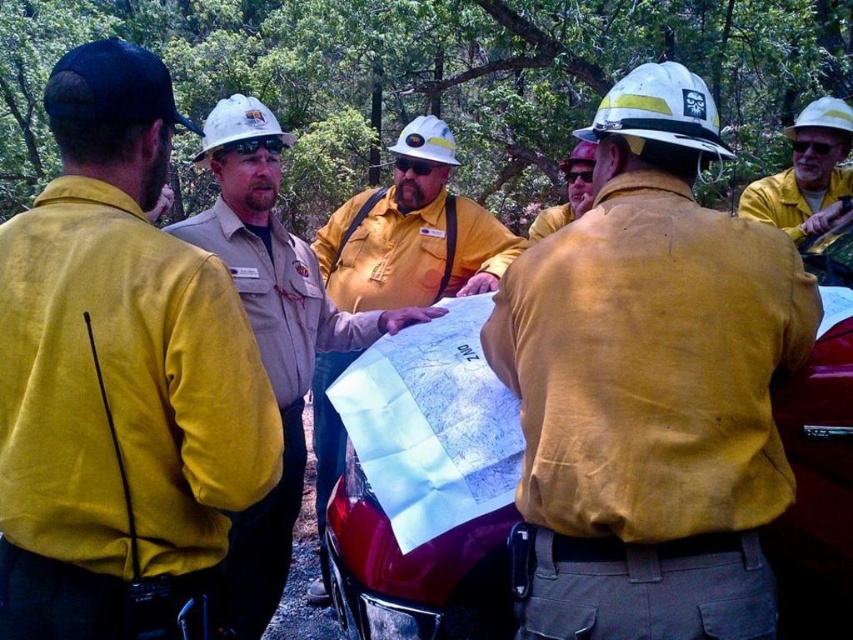
You are a new member of the team and need to locate the white hard hat at center and the matte yellow safety vest at center. Based on the scene description, which object is positioned to the right of the other?

The matte yellow safety vest at center is to the right of white hard hat at center.